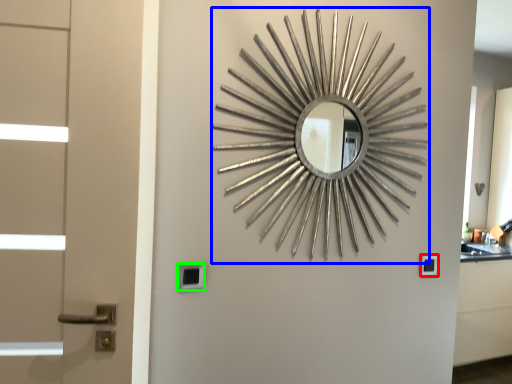
Question: Considering the real-world distances, which object is closest to lock (highlighted by a red box)? design (highlighted by a blue box) or lock (highlighted by a green box).

Choices:
 (A) design
 (B) lock

Answer: (A)